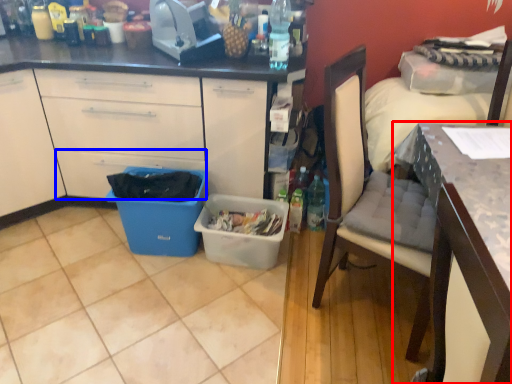
Question: Which of the following is the farthest to the observer, desk (highlighted by a red box) or drawer (highlighted by a blue box)?

Choices:
 (A) desk
 (B) drawer

Answer: (B)